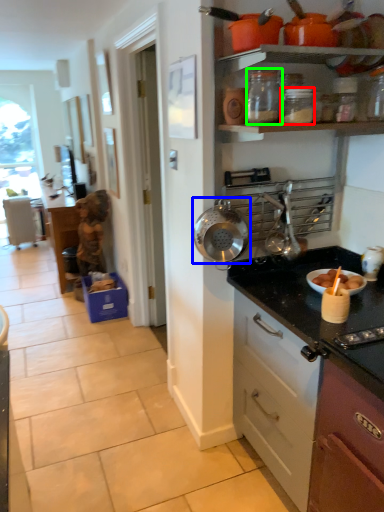
Question: Considering the real-world distances, which object is closest to kitchen appliance (highlighted by a red box)? kitchen appliance (highlighted by a blue box) or kitchen appliance (highlighted by a green box).

Choices:
 (A) kitchen appliance
 (B) kitchen appliance

Answer: (B)